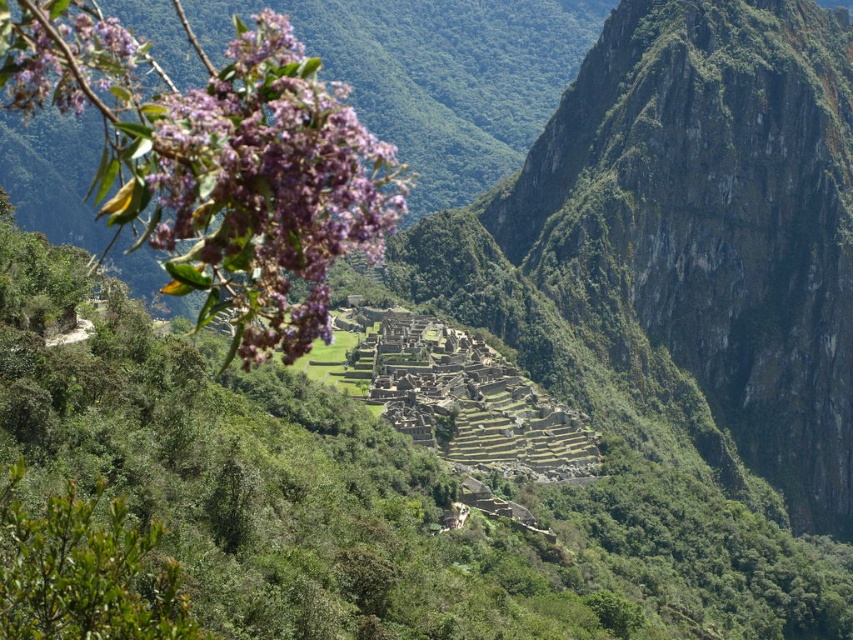
Question: Is purple matte flowers at upper left thinner than purple matte flower at upper left?

Choices:
 (A) yes
 (B) no

Answer: (B)

Question: Does purple matte flowers at upper left have a larger size compared to purple matte flower at upper left?

Choices:
 (A) no
 (B) yes

Answer: (B)

Question: Is the position of purple matte flowers at upper left less distant than that of purple matte flower at upper left?

Choices:
 (A) yes
 (B) no

Answer: (B)

Question: Which point is farther to the camera?

Choices:
 (A) (239, 256)
 (B) (6, 40)

Answer: (A)